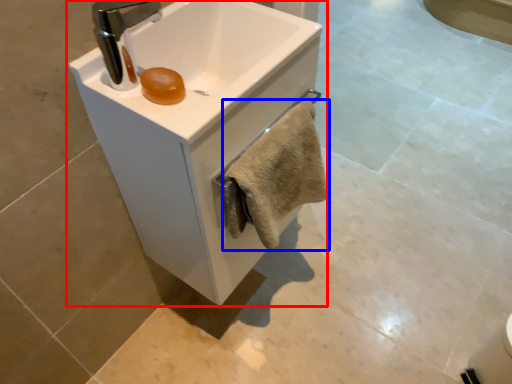
Question: Which of the following is the farthest to the observer, sink (highlighted by a red box) or bath towel (highlighted by a blue box)?

Choices:
 (A) sink
 (B) bath towel

Answer: (B)